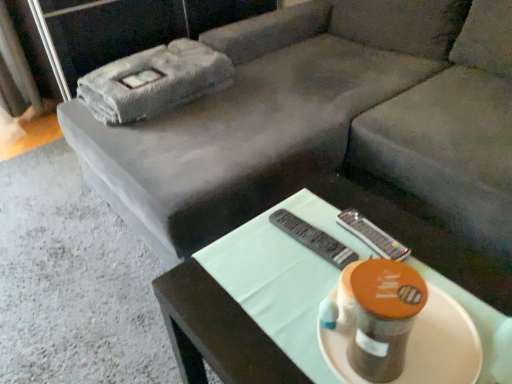
Question: Does black plastic remote at center have a lesser height compared to matte white platter at center?

Choices:
 (A) yes
 (B) no

Answer: (A)

Question: Does black plastic remote at center have a larger size compared to matte white platter at center?

Choices:
 (A) yes
 (B) no

Answer: (B)

Question: From a real-world perspective, is black plastic remote at center beneath matte white platter at center?

Choices:
 (A) no
 (B) yes

Answer: (B)

Question: From a real-world perspective, is black plastic remote at center over matte white platter at center?

Choices:
 (A) yes
 (B) no

Answer: (B)

Question: Considering the relative positions of black plastic remote at center and matte white platter at center in the image provided, is black plastic remote at center to the left of matte white platter at center from the viewer's perspective?

Choices:
 (A) no
 (B) yes

Answer: (B)

Question: Considering the positions of matte black table at center and black plastic remote at center in the image, is matte black table at center taller or shorter than black plastic remote at center?

Choices:
 (A) tall
 (B) short

Answer: (A)

Question: Relative to black plastic remote at center, is matte black table at center in front or behind?

Choices:
 (A) behind
 (B) front

Answer: (B)

Question: In the image, is matte black table at center on the left side or the right side of black plastic remote at center?

Choices:
 (A) right
 (B) left

Answer: (A)

Question: From the image's perspective, is matte black table at center above or below black plastic remote at center?

Choices:
 (A) above
 (B) below

Answer: (B)

Question: Based on their sizes in the image, would you say gray fabric couch at center is bigger or smaller than black plastic remote at center?

Choices:
 (A) big
 (B) small

Answer: (A)

Question: Considering the positions of gray fabric couch at center and black plastic remote at center in the image, is gray fabric couch at center wider or thinner than black plastic remote at center?

Choices:
 (A) thin
 (B) wide

Answer: (B)

Question: Considering their positions, is gray fabric couch at center located in front of or behind black plastic remote at center?

Choices:
 (A) front
 (B) behind

Answer: (A)

Question: Is gray fabric couch at center taller or shorter than black plastic remote at center?

Choices:
 (A) short
 (B) tall

Answer: (B)

Question: Relative to black plastic remote at center, is matte white platter at center in front or behind?

Choices:
 (A) front
 (B) behind

Answer: (A)

Question: Is matte white platter at center situated inside black plastic remote at center or outside?

Choices:
 (A) outside
 (B) inside

Answer: (A)